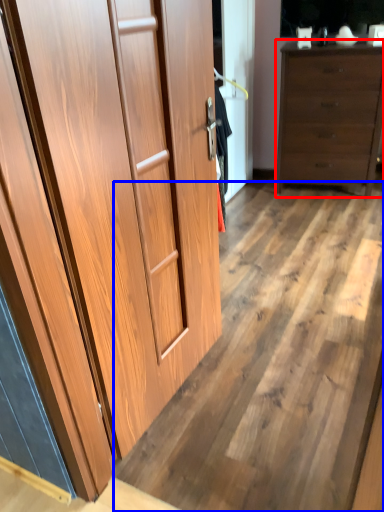
Question: Which object is closer to the camera taking this photo, chest of drawers (highlighted by a red box) or plywood (highlighted by a blue box)?

Choices:
 (A) chest of drawers
 (B) plywood

Answer: (B)